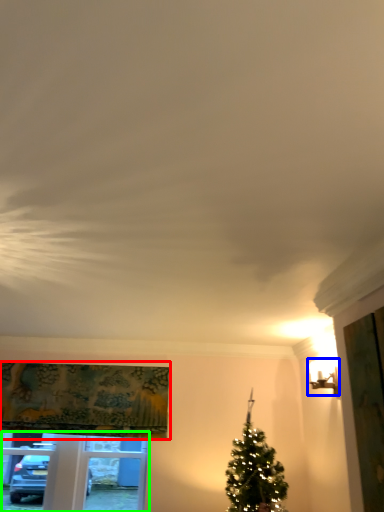
Question: Which is nearer to the curtain (highlighted by a red box)? light fixture (highlighted by a blue box) or window frame (highlighted by a green box).

Choices:
 (A) light fixture
 (B) window frame

Answer: (B)